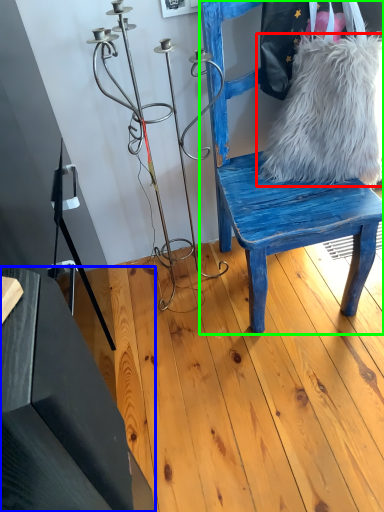
Question: Considering the real-world distances, which object is closest to fur (highlighted by a red box)? table (highlighted by a blue box) or chair (highlighted by a green box).

Choices:
 (A) table
 (B) chair

Answer: (B)